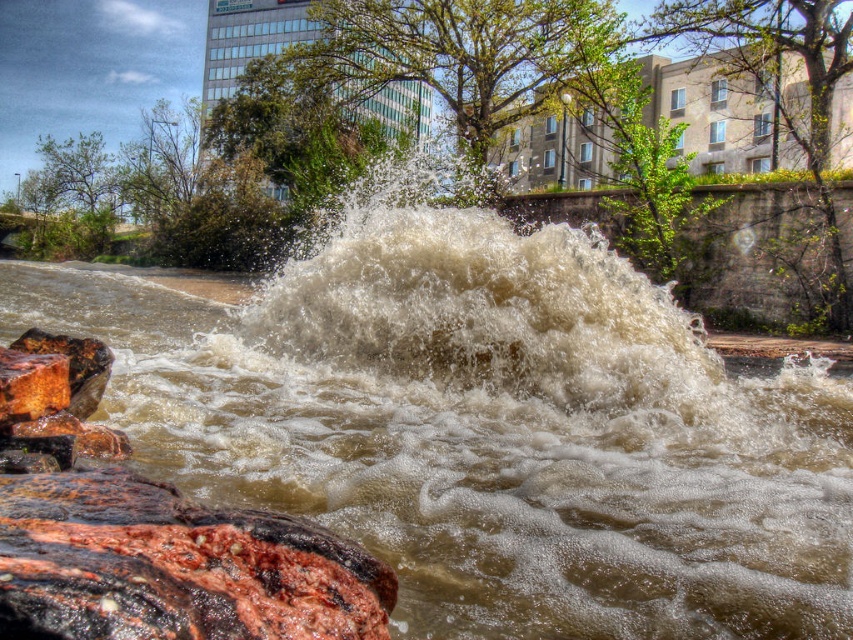
Question: Can you confirm if brown foamy water at center is positioned above frothy white water at center?

Choices:
 (A) no
 (B) yes

Answer: (A)

Question: Does brown foamy water at center have a smaller size compared to frothy white water at center?

Choices:
 (A) no
 (B) yes

Answer: (A)

Question: Among these points, which one is farthest from the camera?

Choices:
 (A) (254, 458)
 (B) (694, 362)

Answer: (B)

Question: Among these points, which one is nearest to the camera?

Choices:
 (A) (15, 300)
 (B) (709, 349)

Answer: (B)

Question: Can you confirm if brown foamy water at center is smaller than frothy white water at center?

Choices:
 (A) yes
 (B) no

Answer: (B)